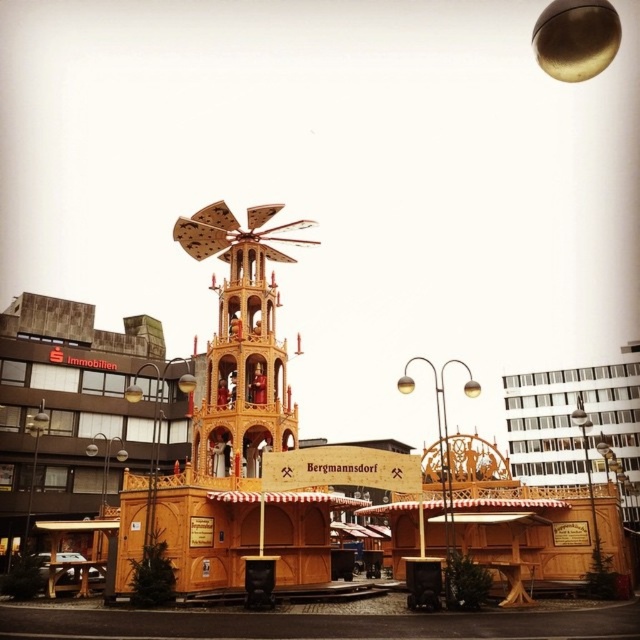
You are setting up a display for a Christmas market and need to place a decorative star on top of the tallest object between the wooden christmas pyramid at center and the wooden windmill at center. Which object should you place the star on?

The wooden christmas pyramid at center is wider than the wooden windmill at center, so the star should be placed on the wooden christmas pyramid at center.